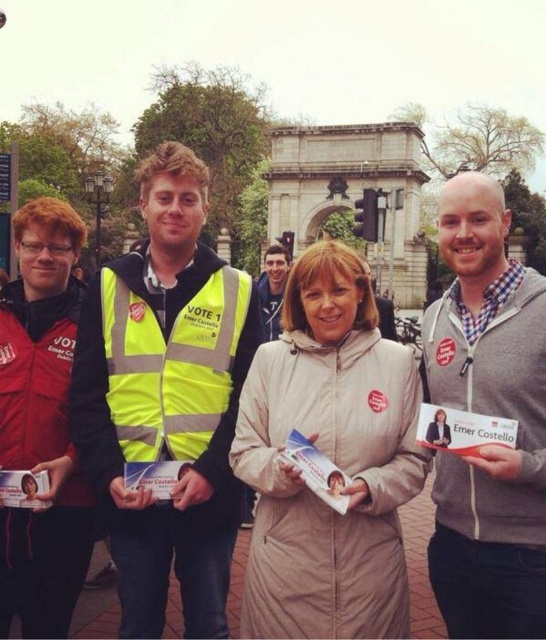
Question: Which object appears closest to the camera in this image?

Choices:
 (A) yellow reflective vest at center
 (B) gray zip-up hoodie at center
 (C) beige fabric coat at center

Answer: (B)

Question: Which point is farther from the camera taking this photo?

Choices:
 (A) (138, 556)
 (B) (273, 275)

Answer: (B)

Question: Can you confirm if beige fleece jacket at center is bigger than gray zip-up hoodie at center?

Choices:
 (A) yes
 (B) no

Answer: (A)

Question: Does beige fleece jacket at center appear on the left side of beige fabric coat at center?

Choices:
 (A) yes
 (B) no

Answer: (B)

Question: Does beige fabric coat at center lie behind light brown hair at center?

Choices:
 (A) no
 (B) yes

Answer: (A)

Question: Which object is the farthest from the yellow reflective vest at center?

Choices:
 (A) light brown hair at center
 (B) beige fleece jacket at center
 (C) beige fabric coat at center

Answer: (A)